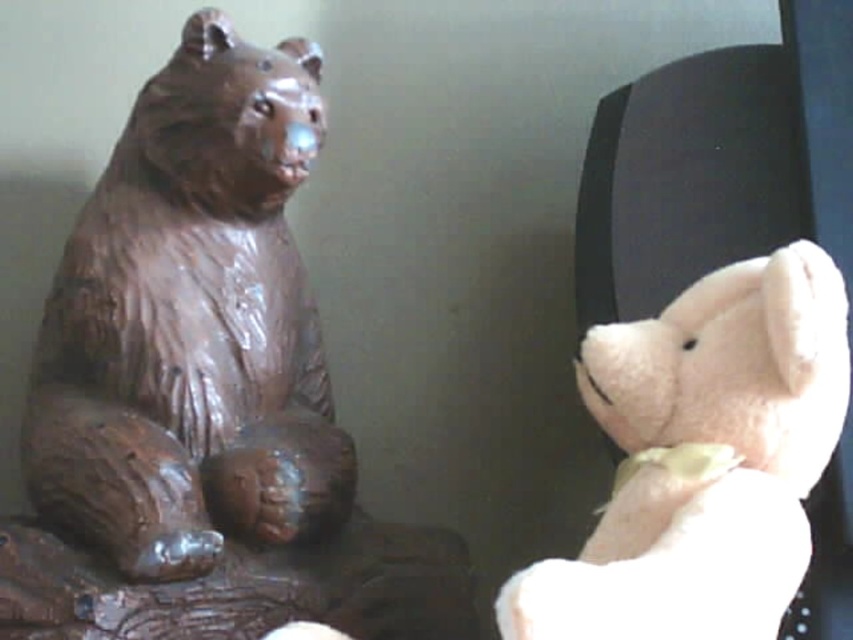
Question: Among these objects, which one is nearest to the camera?

Choices:
 (A) matte wood bear at left
 (B) fluffy white teddy bear at right

Answer: (B)

Question: Among these points, which one is farthest from the camera?

Choices:
 (A) (173, 280)
 (B) (653, 496)

Answer: (A)

Question: Does matte wood bear at left come behind fluffy white teddy bear at right?

Choices:
 (A) yes
 (B) no

Answer: (A)

Question: Observing the image, what is the correct spatial positioning of matte wood bear at left in reference to fluffy white teddy bear at right?

Choices:
 (A) left
 (B) right

Answer: (A)

Question: Which of the following is the closest to the observer?

Choices:
 (A) (96, 499)
 (B) (723, 289)

Answer: (B)

Question: Can you confirm if matte wood bear at left is smaller than fluffy white teddy bear at right?

Choices:
 (A) no
 (B) yes

Answer: (A)